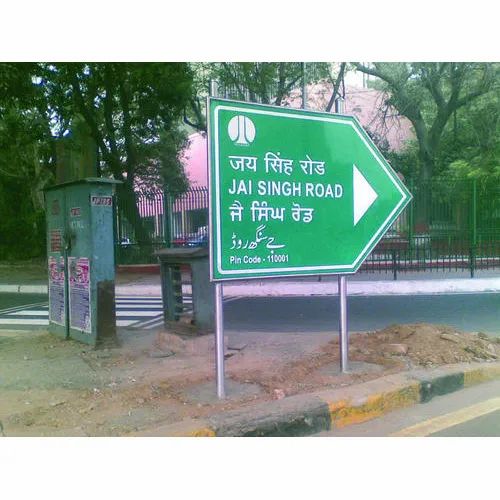
Image resolution: width=500 pixels, height=500 pixels. Identify the location of box. (72, 256).